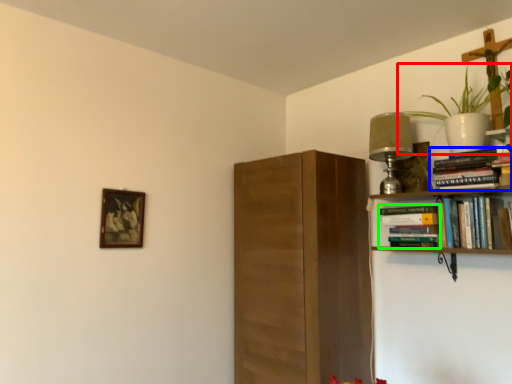
Question: Which object is the farthest from houseplant (highlighted by a red box)? Choose among these: book (highlighted by a blue box) or book (highlighted by a green box).

Choices:
 (A) book
 (B) book

Answer: (B)